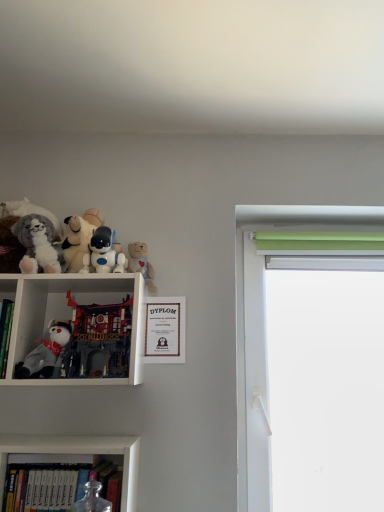
Question: From a real-world perspective, is green fabric at right under white plush bear at upper center, marked as the first toy in a right-to-left arrangement?

Choices:
 (A) yes
 (B) no

Answer: (A)

Question: Is green fabric at right surrounding white plush bear at upper center, positioned as the sixth toy in left-to-right order?

Choices:
 (A) no
 (B) yes

Answer: (A)

Question: Is green fabric at right to the left of white plush bear at upper center, positioned as the sixth toy in left-to-right order, from the viewer's perspective?

Choices:
 (A) yes
 (B) no

Answer: (B)

Question: Considering the relative sizes of green fabric at right and white plush bear at upper center, positioned as the sixth toy in left-to-right order, in the image provided, is green fabric at right taller than white plush bear at upper center, positioned as the sixth toy in left-to-right order,?

Choices:
 (A) no
 (B) yes

Answer: (B)

Question: Does green fabric at right have a lesser height compared to white plush bear at upper center, marked as the first toy in a right-to-left arrangement?

Choices:
 (A) yes
 (B) no

Answer: (B)

Question: From the image's perspective, is green fabric at right below white plush bear at upper center, positioned as the sixth toy in left-to-right order?

Choices:
 (A) yes
 (B) no

Answer: (A)

Question: Does white plush toy at left, which is the fifth toy from right to left, touch white matte robot at upper left, arranged as the fifth toy when viewed from the left?

Choices:
 (A) yes
 (B) no

Answer: (B)

Question: Can you confirm if white plush toy at left, which is the fifth toy from right to left, is shorter than white matte robot at upper left, arranged as the fifth toy when viewed from the left?

Choices:
 (A) yes
 (B) no

Answer: (B)

Question: Considering the relative sizes of white plush toy at left, the second toy positioned from the left, and white matte robot at upper left, arranged as the fifth toy when viewed from the left, in the image provided, is white plush toy at left, the second toy positioned from the left, wider than white matte robot at upper left, arranged as the fifth toy when viewed from the left,?

Choices:
 (A) yes
 (B) no

Answer: (A)

Question: From the image's perspective, does white plush toy at left, the second toy positioned from the left, appear higher than white matte robot at upper left, arranged as the fifth toy when viewed from the left?

Choices:
 (A) no
 (B) yes

Answer: (A)

Question: Is white plush toy at left, which is the fifth toy from right to left, positioned behind white matte robot at upper left, the 2th toy in the right-to-left sequence?

Choices:
 (A) no
 (B) yes

Answer: (A)

Question: Is white plush toy at left, which is the fifth toy from right to left, outside white matte robot at upper left, the 2th toy in the right-to-left sequence?

Choices:
 (A) no
 (B) yes

Answer: (B)

Question: From a real-world perspective, is white plush toy at left, which is the fifth toy from right to left, beneath matte gold picture frame at center?

Choices:
 (A) yes
 (B) no

Answer: (A)